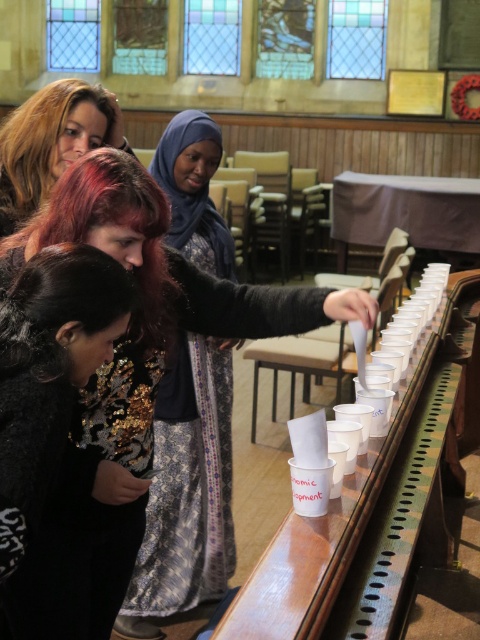
Question: Is patterned fabric dress at center positioned before black sequined dress at lower left?

Choices:
 (A) yes
 (B) no

Answer: (B)

Question: Is sequined fabric dress at center to the left of black sequined dress at lower left from the viewer's perspective?

Choices:
 (A) yes
 (B) no

Answer: (B)

Question: Is patterned fabric dress at center above matte black hair at upper left?

Choices:
 (A) yes
 (B) no

Answer: (B)

Question: Which object is the closest to the black sequined dress at lower left?

Choices:
 (A) sequined fabric dress at center
 (B) matte black hair at upper left

Answer: (A)

Question: Which object appears closest to the camera in this image?

Choices:
 (A) black sequined dress at lower left
 (B) matte black hair at upper left
 (C) sequined fabric dress at center

Answer: (A)

Question: Which of the following is the farthest from the observer?

Choices:
 (A) (38, 371)
 (B) (205, 474)
 (C) (118, 595)
 (D) (82, 148)

Answer: (B)